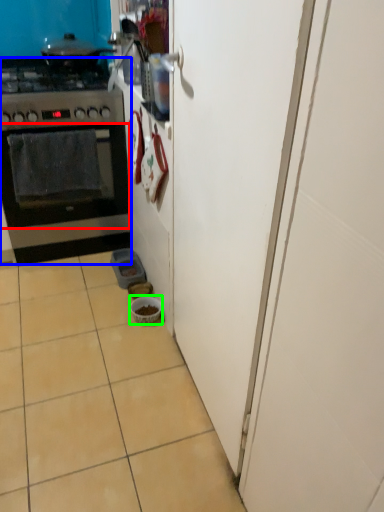
Question: Considering the real-world distances, which object is closest to oven (highlighted by a red box)? kitchen appliance (highlighted by a blue box) or bowl (highlighted by a green box).

Choices:
 (A) kitchen appliance
 (B) bowl

Answer: (A)